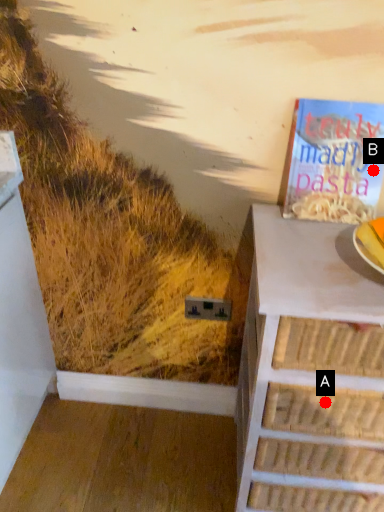
Question: Two points are circled on the image, labeled by A and B beside each circle. Among these points, which one is farthest from the camera?

Choices:
 (A) A is further
 (B) B is further

Answer: (B)